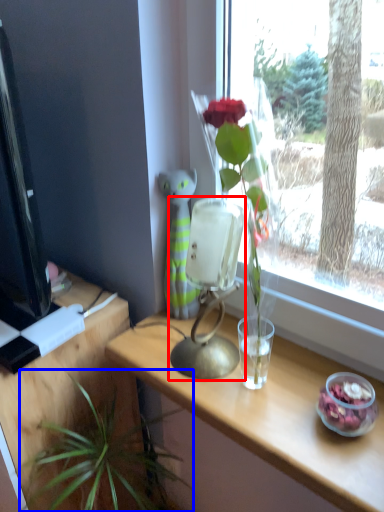
Question: Which of the following is the closest to the observer, table lamp (highlighted by a red box) or houseplant (highlighted by a blue box)?

Choices:
 (A) table lamp
 (B) houseplant

Answer: (B)